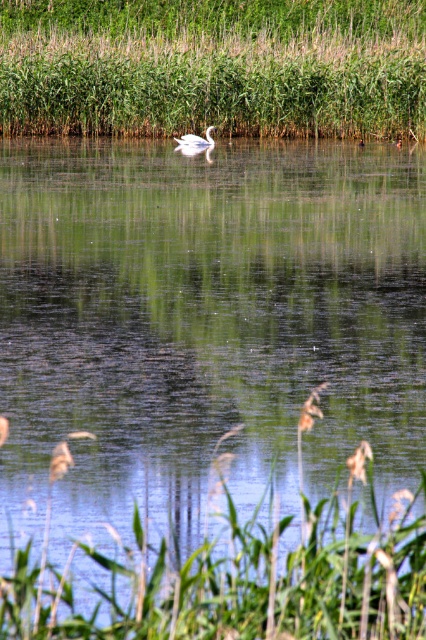
Consider the image. You are a photographer trying to capture the white glossy swan at center in your shot. You notice the green leafy grass at lower center might block the view. Based on their heights, will the grass obstruct the swan?

The green leafy grass at lower center is taller than the white glossy swan at center, so it will obstruct the view of the swan.

You are an environmental scientist observing the scene. You need to determine which area has larger vegetation for a study. Which of the following has larger vegetation between the green grass at upper center and the green leafy grass at lower center?

The green grass at upper center is bigger than the green leafy grass at lower center, so the area with larger vegetation is the green grass at upper center.

You are standing at the edge of the water in the scene. If you look towards the direction of the swan, where would you see the green leafy grass at lower center relative to your position?

The green leafy grass at lower center is located at the lower center of the image, which would be directly in front of you if you are facing the swan.